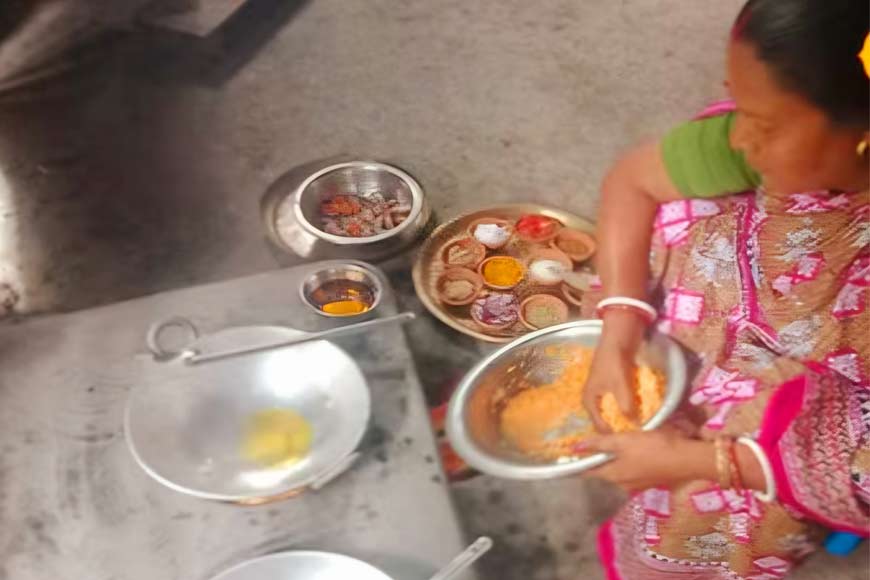
The height and width of the screenshot is (580, 870). I want to click on bowls, so click(459, 279).